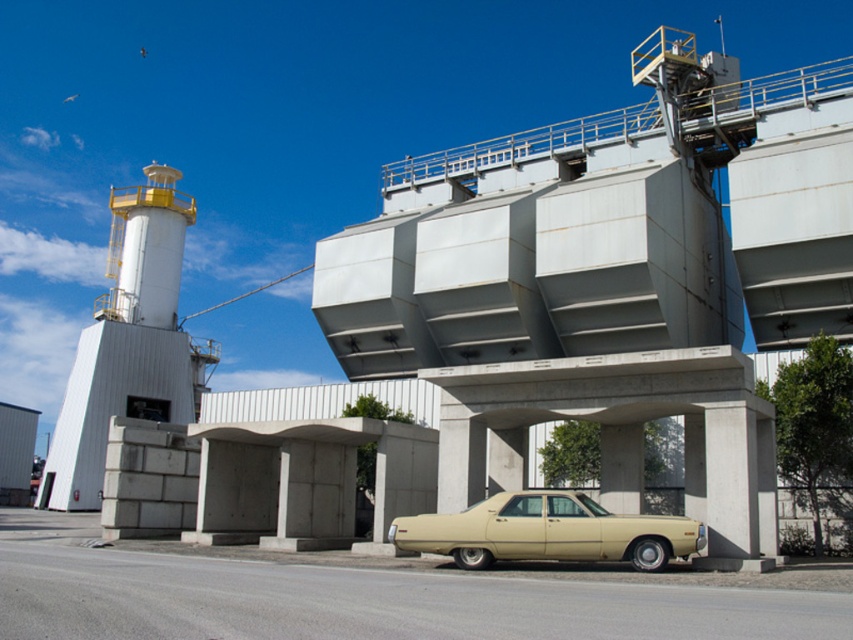
Does white matte control tower at left appear under beige matte sedan at center?

Actually, white matte control tower at left is above beige matte sedan at center.

Image resolution: width=853 pixels, height=640 pixels. Describe the element at coordinates (128, 342) in the screenshot. I see `white matte control tower at left` at that location.

The image size is (853, 640). In order to click on white matte control tower at left in this screenshot , I will do `click(128, 342)`.